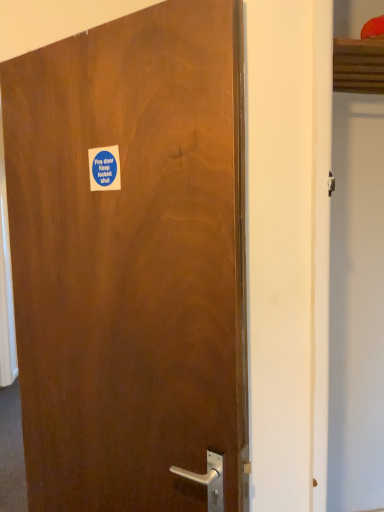
Question: From a real-world perspective, is blue paper sticker at upper left under brown matte door at center?

Choices:
 (A) no
 (B) yes

Answer: (A)

Question: Is blue paper sticker at upper left shorter than brown matte door at center?

Choices:
 (A) no
 (B) yes

Answer: (B)

Question: Is blue paper sticker at upper left turned away from brown matte door at center?

Choices:
 (A) yes
 (B) no

Answer: (A)

Question: Does blue paper sticker at upper left have a greater width compared to brown matte door at center?

Choices:
 (A) yes
 (B) no

Answer: (B)

Question: Does blue paper sticker at upper left have a lesser width compared to brown matte door at center?

Choices:
 (A) yes
 (B) no

Answer: (A)

Question: Is blue paper sticker at upper left oriented towards brown matte door at center?

Choices:
 (A) yes
 (B) no

Answer: (A)

Question: From the image's perspective, is brown matte door at center on top of blue paper sticker at upper left?

Choices:
 (A) yes
 (B) no

Answer: (B)

Question: Is brown matte door at center facing away from blue paper sticker at upper left?

Choices:
 (A) yes
 (B) no

Answer: (A)

Question: From the image's perspective, would you say brown matte door at center is shown under blue paper sticker at upper left?

Choices:
 (A) no
 (B) yes

Answer: (B)

Question: Could you tell me if brown matte door at center is facing blue paper sticker at upper left?

Choices:
 (A) yes
 (B) no

Answer: (A)

Question: From a real-world perspective, is brown matte door at center below blue paper sticker at upper left?

Choices:
 (A) yes
 (B) no

Answer: (A)

Question: Is brown matte door at center far away from blue paper sticker at upper left?

Choices:
 (A) no
 (B) yes

Answer: (A)

Question: In the image, is brown matte door at center positioned in front of or behind blue paper sticker at upper left?

Choices:
 (A) behind
 (B) front

Answer: (B)